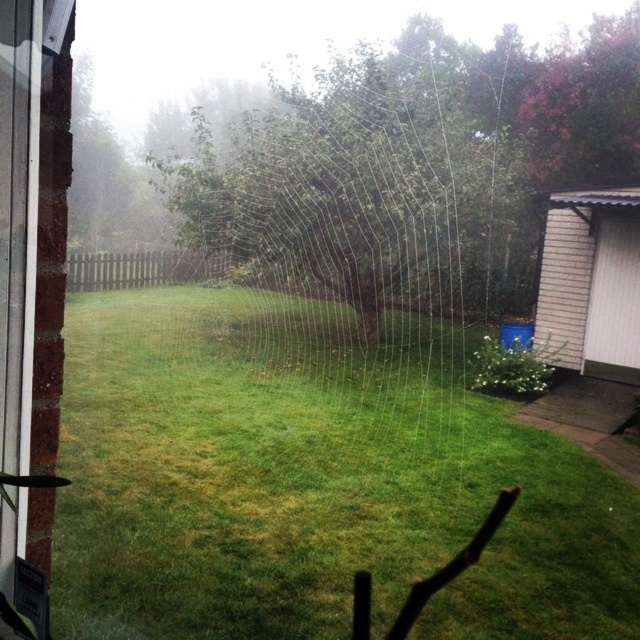
Is point (289, 141) closer to viewer compared to point (602, 346)?

No.

Is transparent silk spider web at center shorter than white plastic screen door at right?

In fact, transparent silk spider web at center may be taller than white plastic screen door at right.

Between point (305, 166) and point (632, 280), which one is positioned in front?

Point (632, 280) is in front.

Locate an element on the screen. This screenshot has height=640, width=640. transparent silk spider web at center is located at coordinates (356, 225).

Is clear glass window at left positioned behind white plastic screen door at right?

No, it is not.

Is clear glass window at left to the left of white plastic screen door at right from the viewer's perspective?

Yes, clear glass window at left is to the left of white plastic screen door at right.

Is point (49, 381) positioned before point (637, 340)?

Yes, it is in front of point (637, 340).

I want to click on clear glass window at left, so click(29, 291).

At what (x,y) coordinates should I click in order to perform the action: click on green grass at center. Please return your answer as a coordinate pair (x, y). Looking at the image, I should click on (310, 483).

Is point (131, 496) positioned before point (8, 496)?

No.

At what (x,y) coordinates should I click in order to perform the action: click on green grass at center. Please return your answer as a coordinate pair (x, y). This screenshot has width=640, height=640. Looking at the image, I should click on (310, 483).